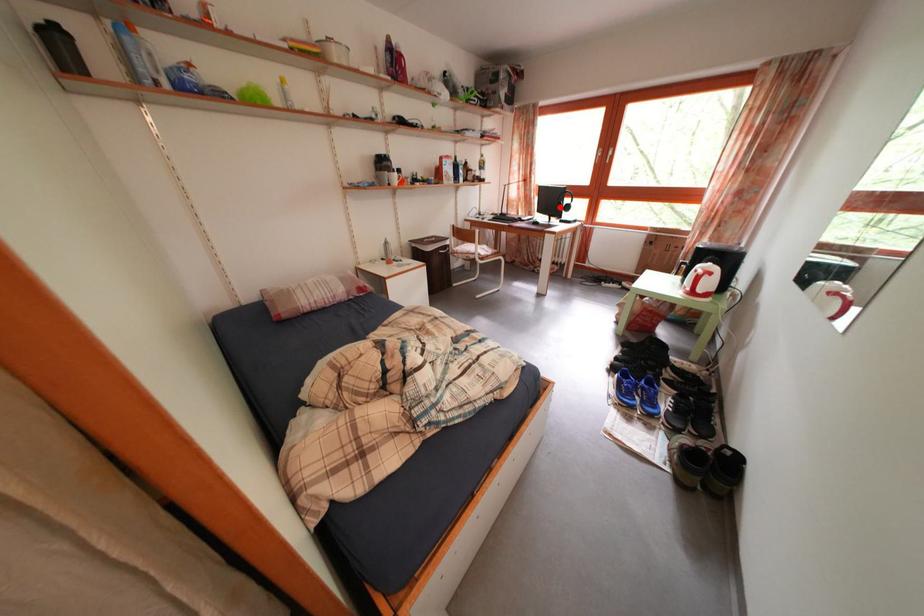
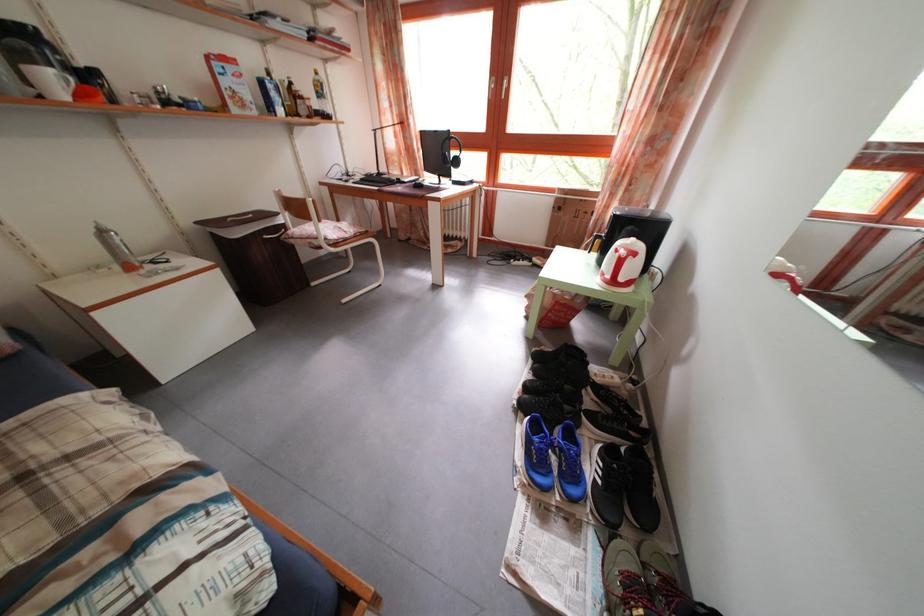
Locate, in the second image, the point that corresponds to the highlighted location in the first image.

(446, 160)